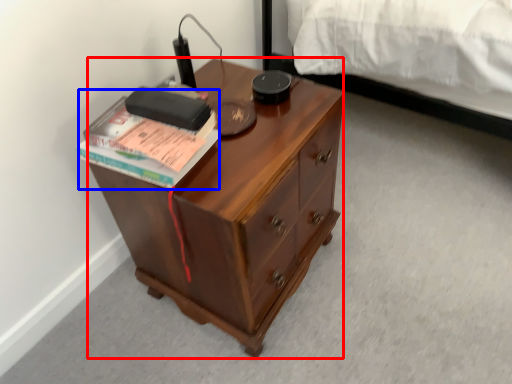
Question: Which of the following is the farthest to the observer, desk (highlighted by a red box) or paperback book (highlighted by a blue box)?

Choices:
 (A) desk
 (B) paperback book

Answer: (B)